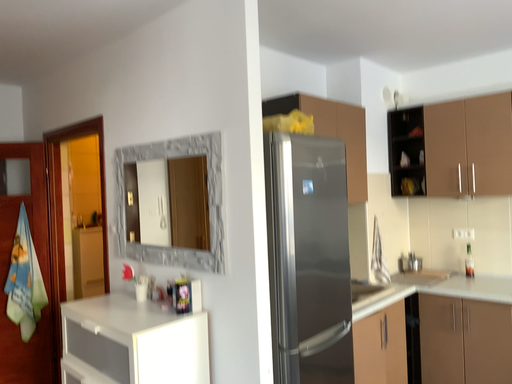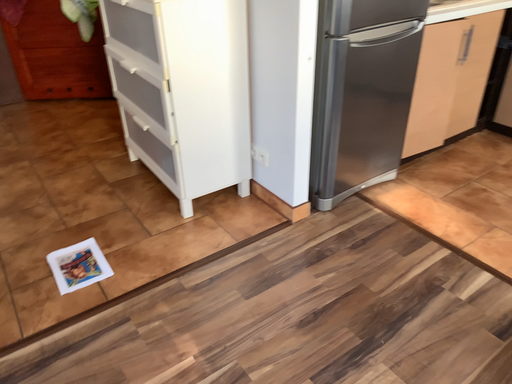
Question: How did the camera likely rotate when shooting the video?

Choices:
 (A) rotated left
 (B) rotated right

Answer: (A)